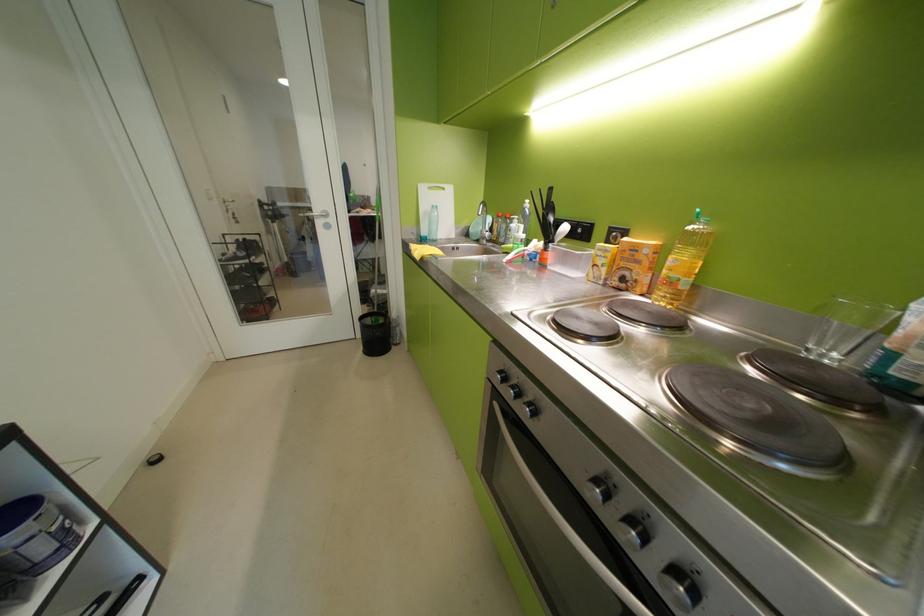
Where is `faucet handle`? This screenshot has height=616, width=924. faucet handle is located at coordinates tap(481, 220).